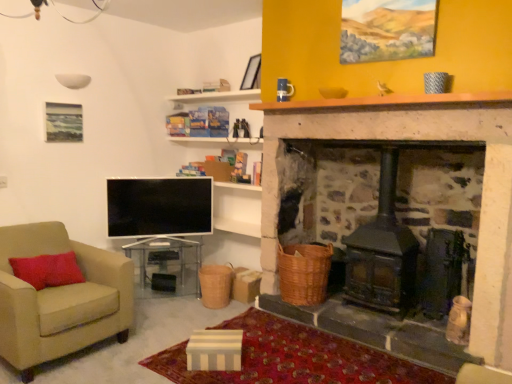
Question: Should I look upward or downward to see woven brown basket at lower center, which is the 1th basket in right-to-left order?

Choices:
 (A) up
 (B) down

Answer: (B)

Question: Can you confirm if flat screen tv at lower left is bigger than woven brown basket at lower center, which is the 2th basket from left to right?

Choices:
 (A) yes
 (B) no

Answer: (B)

Question: Is flat screen tv at lower left looking in the opposite direction of woven brown basket at lower center, which is the 1th basket in right-to-left order?

Choices:
 (A) yes
 (B) no

Answer: (B)

Question: Can you confirm if flat screen tv at lower left is shorter than woven brown basket at lower center, which is the 2th basket from left to right?

Choices:
 (A) yes
 (B) no

Answer: (B)

Question: Is flat screen tv at lower left in front of woven brown basket at lower center, which is the 1th basket in right-to-left order?

Choices:
 (A) yes
 (B) no

Answer: (B)

Question: Considering the relative positions of flat screen tv at lower left and woven brown basket at lower center, which is the 2th basket from left to right, in the image provided, is flat screen tv at lower left to the right of woven brown basket at lower center, which is the 2th basket from left to right, from the viewer's perspective?

Choices:
 (A) yes
 (B) no

Answer: (B)

Question: Is flat screen tv at lower left aimed at woven brown basket at lower center, which is the 2th basket from left to right?

Choices:
 (A) no
 (B) yes

Answer: (A)

Question: Does braided wicker basket at center, which ranks as the 1th basket in left-to-right order, come behind brown wooden mantle at upper center?

Choices:
 (A) yes
 (B) no

Answer: (A)

Question: Can you confirm if braided wicker basket at center, which is counted as the second basket, starting from the right, is thinner than brown wooden mantle at upper center?

Choices:
 (A) no
 (B) yes

Answer: (A)

Question: Considering the relative sizes of braided wicker basket at center, which ranks as the 1th basket in left-to-right order, and brown wooden mantle at upper center in the image provided, is braided wicker basket at center, which ranks as the 1th basket in left-to-right order, smaller than brown wooden mantle at upper center?

Choices:
 (A) no
 (B) yes

Answer: (A)

Question: Is braided wicker basket at center, which is counted as the second basket, starting from the right, located outside brown wooden mantle at upper center?

Choices:
 (A) no
 (B) yes

Answer: (B)

Question: Does braided wicker basket at center, which is counted as the second basket, starting from the right, appear on the right side of brown wooden mantle at upper center?

Choices:
 (A) no
 (B) yes

Answer: (A)

Question: From a real-world perspective, is braided wicker basket at center, which ranks as the 1th basket in left-to-right order, below brown wooden mantle at upper center?

Choices:
 (A) no
 (B) yes

Answer: (B)

Question: Is the depth of matte black picture frame at upper center greater than that of braided wicker basket at center, which is counted as the second basket, starting from the right?

Choices:
 (A) yes
 (B) no

Answer: (A)